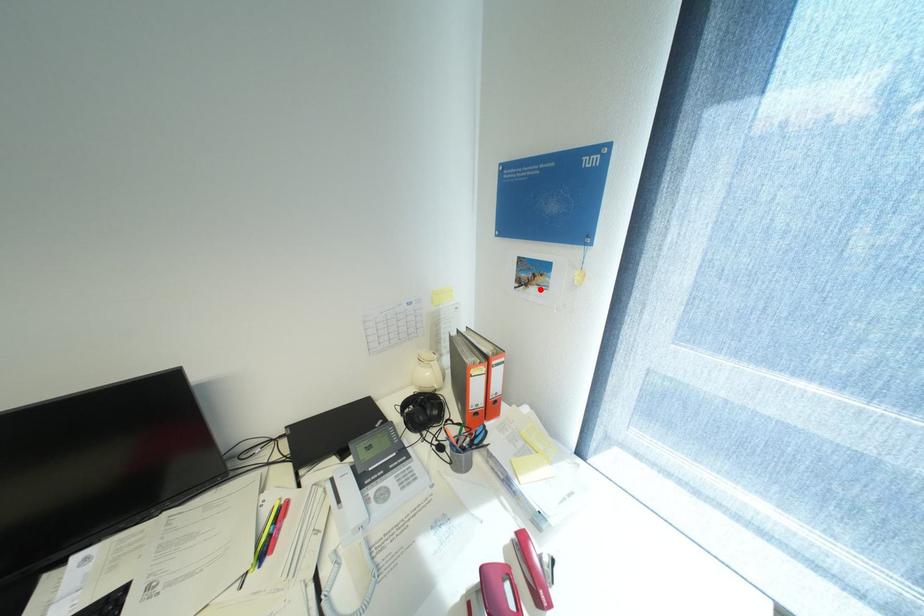
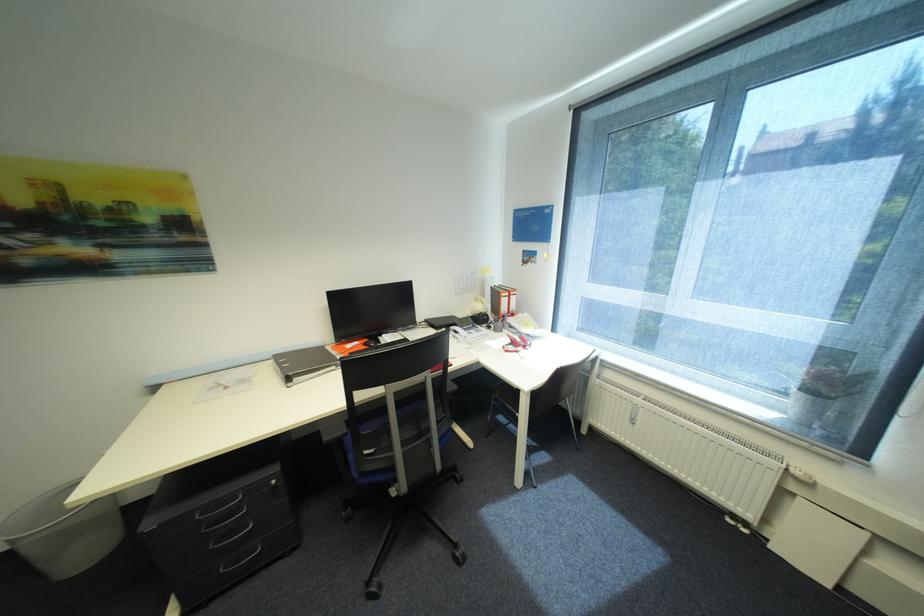
The point at the highlighted location is marked in the first image. Where is the corresponding point in the second image?

(537, 265)